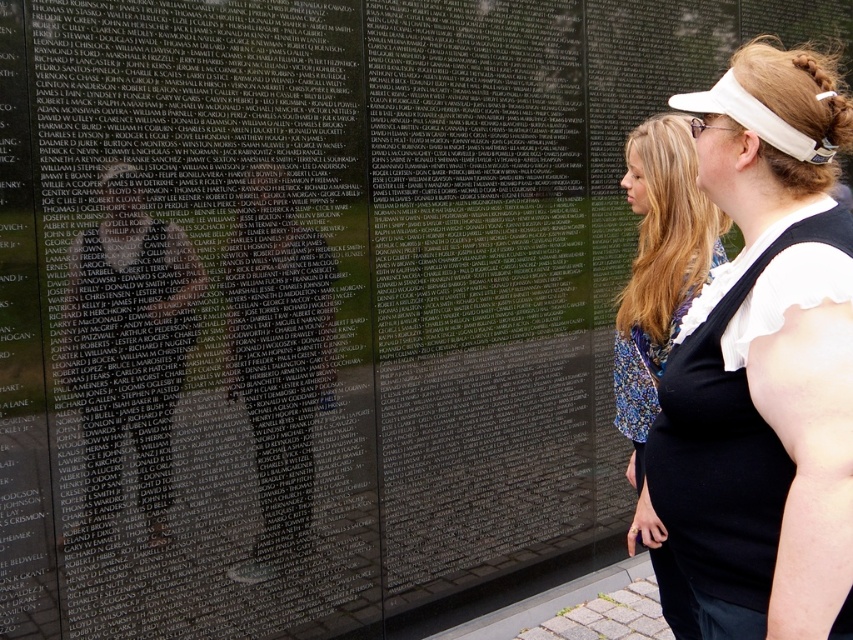
Does matte black dress at center appear on the right side of blonde hair at upper center?

Incorrect, matte black dress at center is not on the right side of blonde hair at upper center.

Who is more forward, (653, 541) or (836, 141)?

Positioned in front is point (836, 141).

I want to click on matte black dress at center, so click(660, 316).

Between matte white visor at upper right and blonde hair at upper center, which one appears on the left side from the viewer's perspective?

From the viewer's perspective, matte white visor at upper right appears more on the left side.

Can you confirm if matte white visor at upper right is taller than blonde hair at upper center?

Yes, matte white visor at upper right is taller than blonde hair at upper center.

In the scene shown: Who is more distant from viewer, [776,317] or [843,124]?

The point [843,124] is behind.

Locate an element on the screen. This screenshot has height=640, width=853. matte white visor at upper right is located at coordinates (763, 374).

Who is higher up, matte white visor at upper right or matte black dress at center?

matte white visor at upper right is higher up.

Which is behind, point (825, 404) or point (631, 264)?

The point (631, 264) is more distant.

Find the location of a particular element. The image size is (853, 640). matte white visor at upper right is located at coordinates (763, 374).